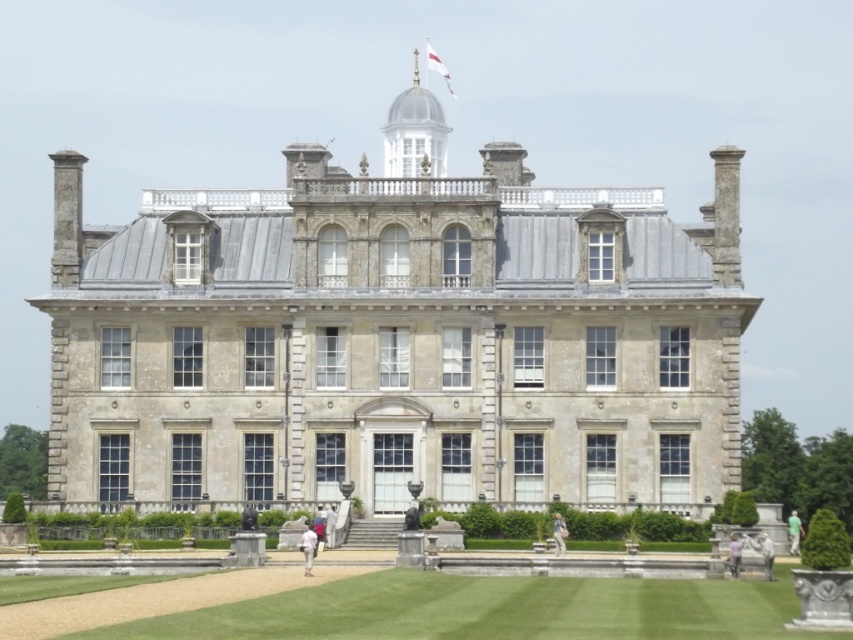
Can you confirm if stone mansion at center is taller than green fabric shirt at center?

Indeed, stone mansion at center has a greater height compared to green fabric shirt at center.

Which is below, stone mansion at center or green fabric shirt at center?

Positioned lower is green fabric shirt at center.

Image resolution: width=853 pixels, height=640 pixels. Describe the element at coordinates (397, 337) in the screenshot. I see `stone mansion at center` at that location.

In order to click on stone mansion at center in this screenshot , I will do `click(397, 337)`.

What do you see at coordinates (308, 548) in the screenshot? I see `white fabric person at center` at bounding box center [308, 548].

Which is below, white fabric person at center or light purple fabric at center?

light purple fabric at center

In the scene shown: Who is more distant from viewer, [300,541] or [729,556]?

Point [300,541]

You are a GUI agent. You are given a task and a screenshot of the screen. Output one action in this format:
    pyautogui.click(x=<x>, y=<y>)
    Task: Click on the white fabric person at center
    
    Given the screenshot: What is the action you would take?
    tap(308, 548)

Does point (769, 573) lie behind point (732, 552)?

That is False.

Is the position of light gray stone statue at lower right more distant than that of light purple fabric at center?

No, light gray stone statue at lower right is in front of light purple fabric at center.

Between point (761, 534) and point (734, 556), which one is positioned in front?

Point (734, 556) is in front.

Identify the location of light gray stone statue at lower right. (766, 554).